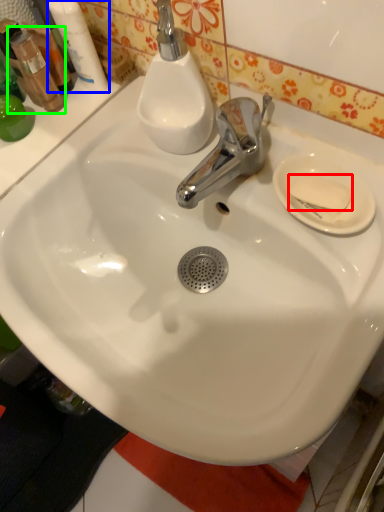
Question: Which object is positioned closest to soap (highlighted by a red box)? Select from mouthwash (highlighted by a blue box) and mouthwash (highlighted by a green box).

Choices:
 (A) mouthwash
 (B) mouthwash

Answer: (A)